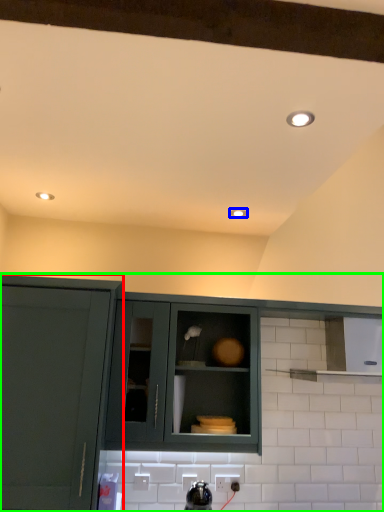
Question: Which object is the farthest from cabinetry (highlighted by a red box)? Choose among these: lighting (highlighted by a blue box) or cabinetry (highlighted by a green box).

Choices:
 (A) lighting
 (B) cabinetry

Answer: (A)